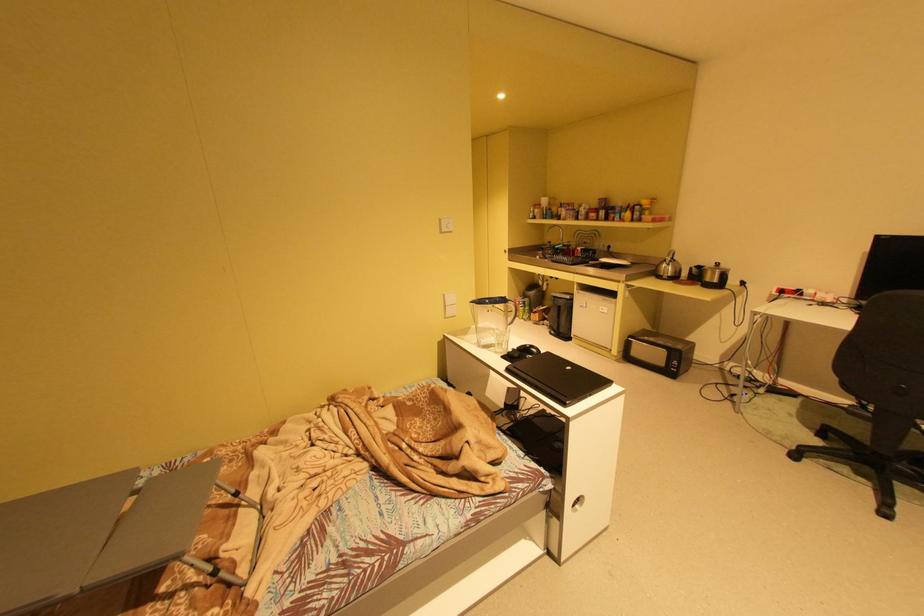
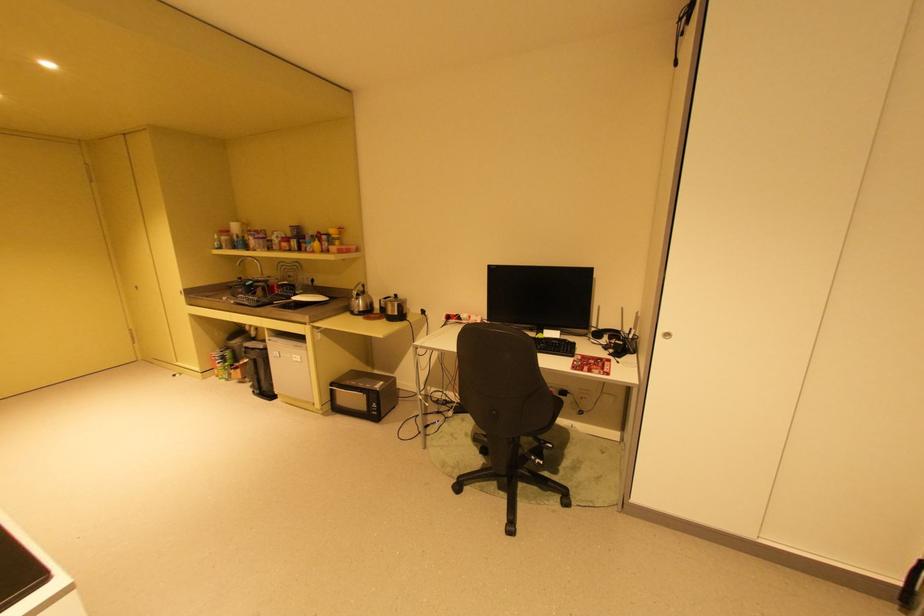
Where in the second image is the point corresponding to (651,330) from the first image?

(359, 371)